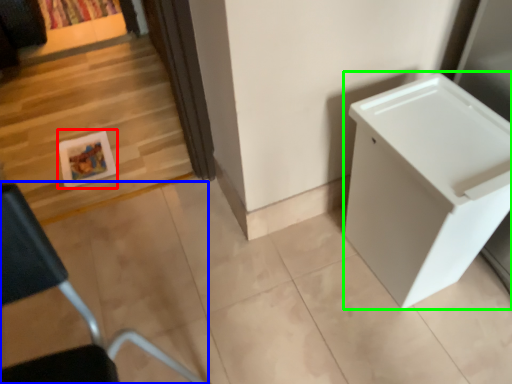
Question: Considering the real-world distances, which object is closest to picture frame (highlighted by a red box)? furniture (highlighted by a blue box) or changing table (highlighted by a green box).

Choices:
 (A) furniture
 (B) changing table

Answer: (A)